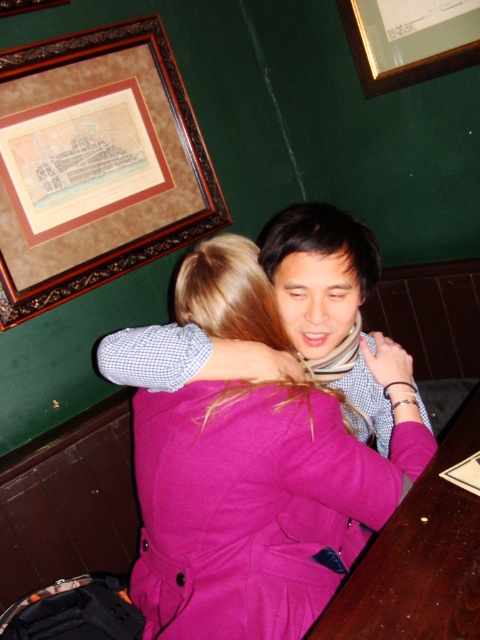
Question: Can you confirm if wooden table at lower right is wider than gold-framed picture at upper center?

Choices:
 (A) yes
 (B) no

Answer: (A)

Question: Which of the following is the closest to the observer?

Choices:
 (A) (383, 26)
 (B) (173, 180)

Answer: (A)

Question: Is the position of wooden framed map at upper left less distant than that of wooden table at lower right?

Choices:
 (A) yes
 (B) no

Answer: (B)

Question: Estimate the real-world distances between objects in this image. Which object is farther from the wooden framed map at upper left?

Choices:
 (A) wooden table at lower right
 (B) purple wool coat at center

Answer: (A)

Question: Considering the real-world distances, which object is farthest from the wooden framed map at upper left?

Choices:
 (A) gold-framed picture at upper center
 (B) purple wool coat at center

Answer: (B)

Question: Does wooden table at lower right have a larger size compared to gold-framed picture at upper center?

Choices:
 (A) no
 (B) yes

Answer: (B)